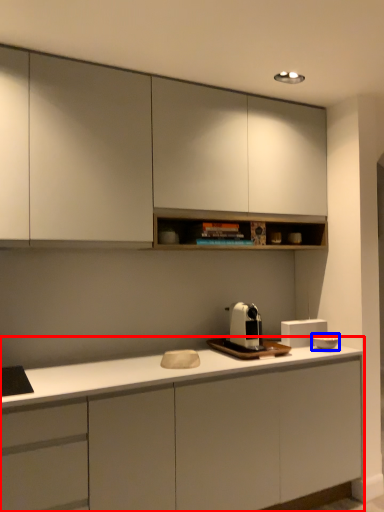
Question: Which point is closer to the camera, cabinetry (highlighted by a red box) or appliance (highlighted by a blue box)?

Choices:
 (A) cabinetry
 (B) appliance

Answer: (A)